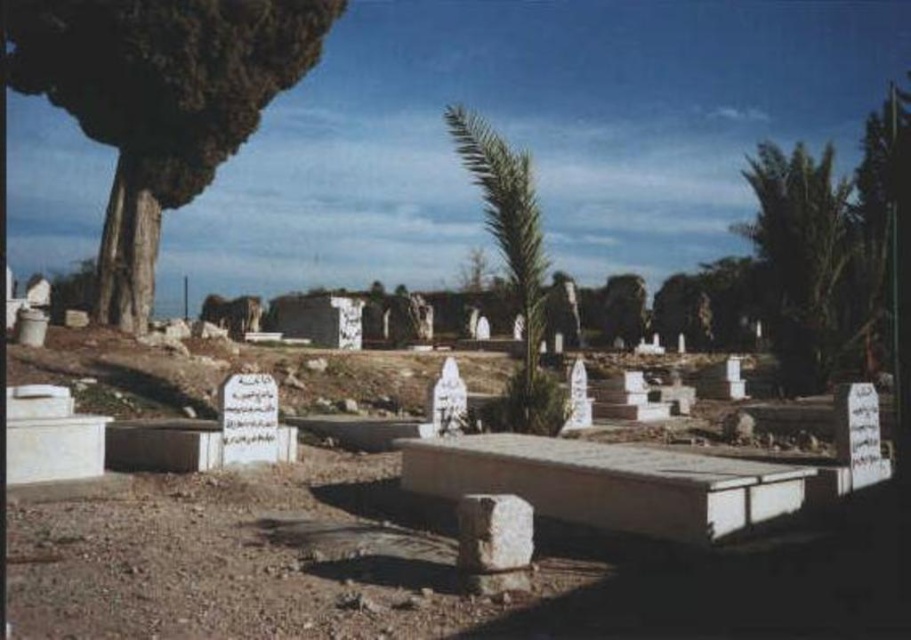
You are standing in the cemetery and want to take a photo of the green leafy palm at center and the white stone gravestone at center. Which object will appear larger in the photo?

The green leafy palm at center will appear larger in the photo because it is much taller than the white stone gravestone at center.

You are standing in the cemetery and want to take a photo of both the point at coordinates (480, 125) and the point at coordinates (466, 515). Which point should you focus on first to ensure both are in clear view?

You should focus on the point at coordinates (480, 125) first because it is closer to the camera than the point at coordinates (466, 515). This ensures both points are in focus as the depth of field will cover the distance between them.